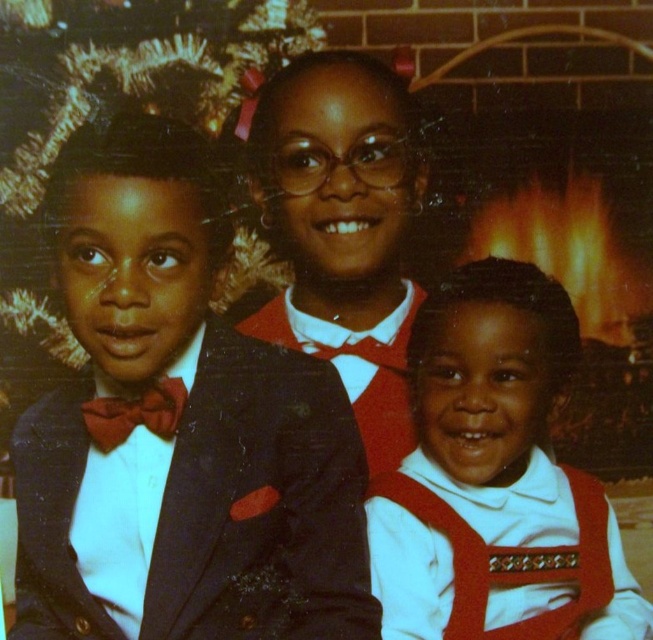
Who is positioned more to the right, matte red vest at lower right or matte red bow tie at left?

From the viewer's perspective, matte red vest at lower right appears more on the right side.

Can you confirm if matte red vest at lower right is shorter than matte red bow tie at left?

Incorrect, matte red vest at lower right's height does not fall short of matte red bow tie at left's.

The width and height of the screenshot is (653, 640). Find the location of `matte red vest at lower right`. matte red vest at lower right is located at coordinates (496, 477).

Which is behind, point (182, 504) or point (146, 388)?

Positioned behind is point (146, 388).

Describe the element at coordinates (182, 435) in the screenshot. The width and height of the screenshot is (653, 640). I see `matte black suit at left` at that location.

Which is behind, point (136, 128) or point (123, 403)?

The point (123, 403) is behind.

Locate an element on the screen. matte black suit at left is located at coordinates (182, 435).

Can you confirm if matte black suit at left is smaller than matte black vest at center?

Incorrect, matte black suit at left is not smaller in size than matte black vest at center.

Is point (125, 497) positioned in front of point (406, 124)?

Yes, it is in front of point (406, 124).

Measure the distance between point (86, 564) and camera.

The distance of point (86, 564) from camera is 3.74 feet.

The width and height of the screenshot is (653, 640). What are the coordinates of `matte black suit at left` in the screenshot? It's located at (182, 435).